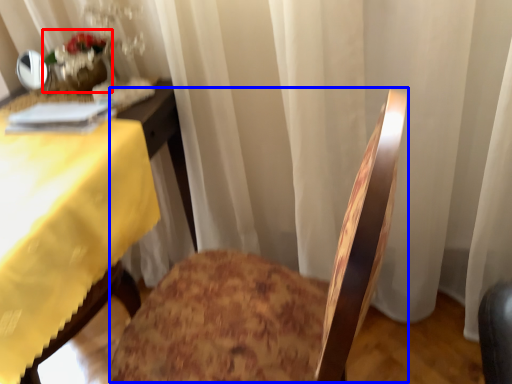
Question: Which of the following is the farthest to the observer, floral arrangement (highlighted by a red box) or rocking chair (highlighted by a blue box)?

Choices:
 (A) floral arrangement
 (B) rocking chair

Answer: (A)